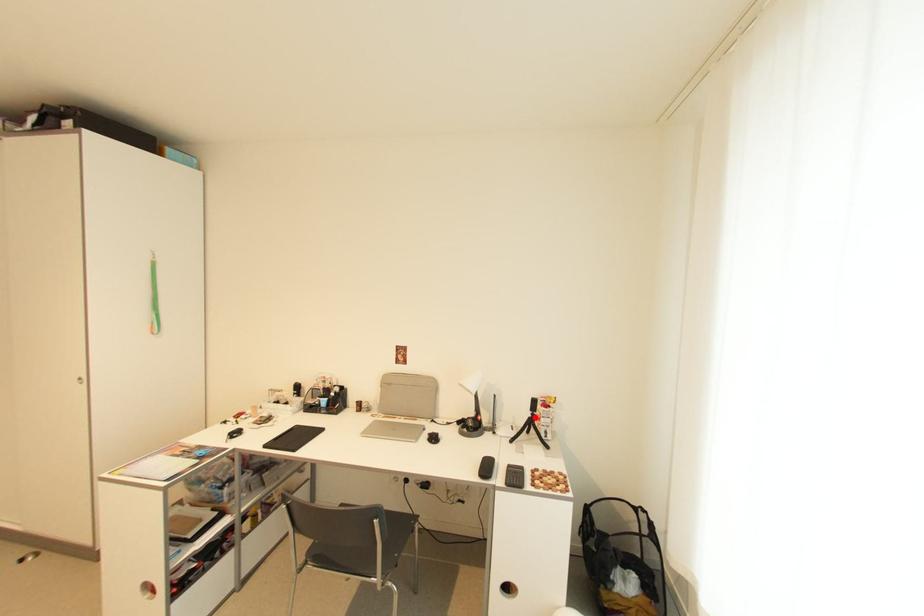
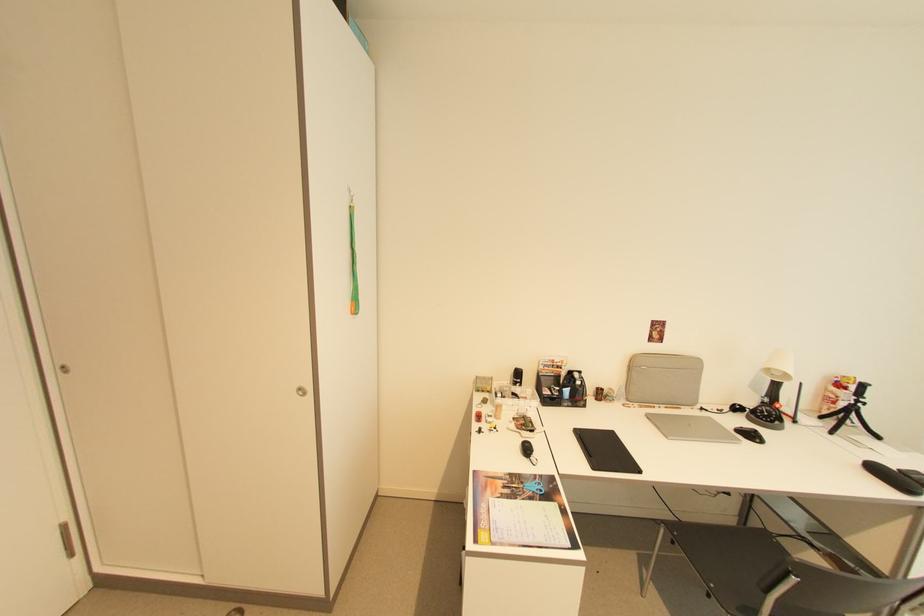
Question: I am providing you with two images of the same scene from different viewpoints. A red point is shown in image1. For the corresponding object point in image2, is it positioned nearer or farther from the camera?

Choices:
 (A) Nearer
 (B) Farther

Answer: (A)